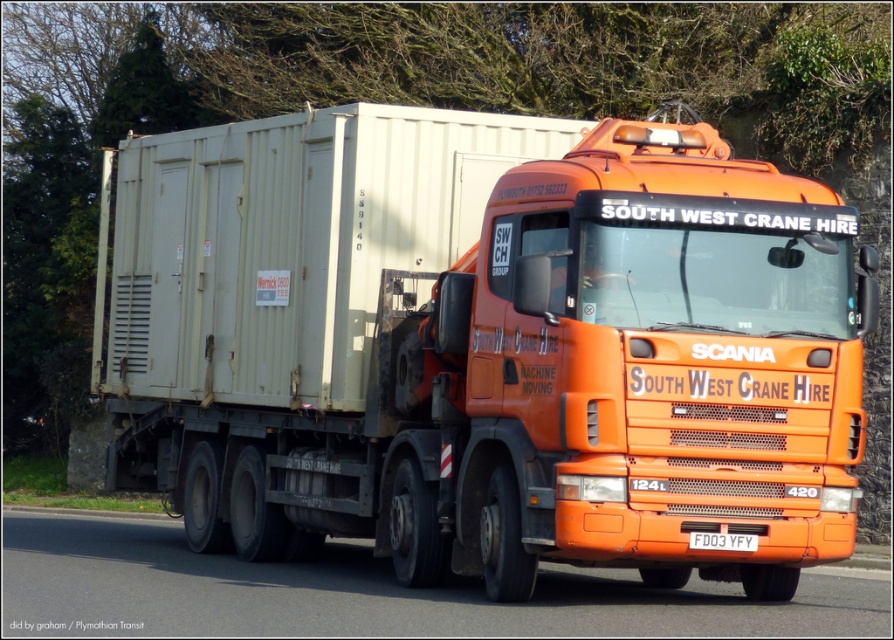
Question: Does orange matte truck at center appear on the left side of white plastic license plate at center?

Choices:
 (A) no
 (B) yes

Answer: (B)

Question: Which of the following is the farthest from the observer?

Choices:
 (A) white plastic license plate at center
 (B) orange glossy truck at center
 (C) orange matte truck at center

Answer: (A)

Question: Which point appears closest to the camera in this image?

Choices:
 (A) (629, 308)
 (B) (304, 612)
 (C) (715, 538)

Answer: (C)

Question: Can you confirm if orange matte truck at center is bigger than white plastic license plate at center?

Choices:
 (A) yes
 (B) no

Answer: (A)

Question: Which of the following is the closest to the observer?

Choices:
 (A) (747, 532)
 (B) (245, 458)
 (C) (82, 516)

Answer: (A)

Question: From the image, what is the correct spatial relationship of orange matte truck at center in relation to orange glossy truck at center?

Choices:
 (A) left
 (B) right

Answer: (B)